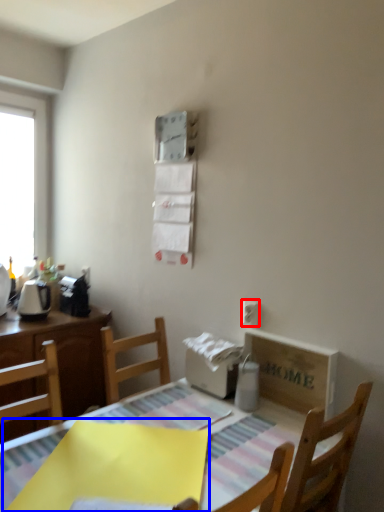
Question: Which object appears closest to the camera in this image, electric outlet (highlighted by a red box) or cloth (highlighted by a blue box)?

Choices:
 (A) electric outlet
 (B) cloth

Answer: (B)